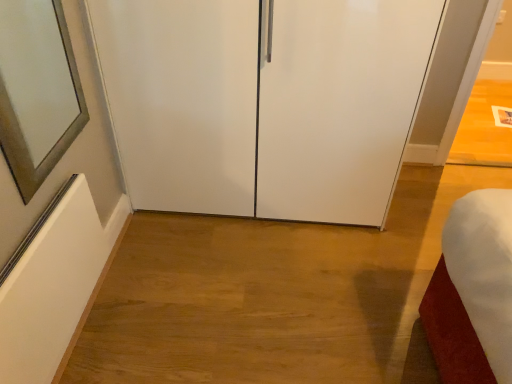
Question: Should I look upward or downward to see satin silver mirror at left?

Choices:
 (A) down
 (B) up

Answer: (B)

Question: Are transparent glass cabinet at center and satin silver mirror at left making contact?

Choices:
 (A) yes
 (B) no

Answer: (B)

Question: Is transparent glass cabinet at center to the right of satin silver mirror at left from the viewer's perspective?

Choices:
 (A) no
 (B) yes

Answer: (B)

Question: Can you confirm if transparent glass cabinet at center is bigger than satin silver mirror at left?

Choices:
 (A) no
 (B) yes

Answer: (B)

Question: Can you confirm if transparent glass cabinet at center is smaller than satin silver mirror at left?

Choices:
 (A) no
 (B) yes

Answer: (A)

Question: Considering the relative sizes of transparent glass cabinet at center and satin silver mirror at left in the image provided, is transparent glass cabinet at center thinner than satin silver mirror at left?

Choices:
 (A) no
 (B) yes

Answer: (A)

Question: Could you tell me if transparent glass cabinet at center is turned towards satin silver mirror at left?

Choices:
 (A) no
 (B) yes

Answer: (B)

Question: Does satin silver mirror at left lie behind transparent glass cabinet at center?

Choices:
 (A) no
 (B) yes

Answer: (A)

Question: Could you tell me if satin silver mirror at left is turned towards transparent glass cabinet at center?

Choices:
 (A) no
 (B) yes

Answer: (A)

Question: From the image's perspective, would you say satin silver mirror at left is shown under transparent glass cabinet at center?

Choices:
 (A) yes
 (B) no

Answer: (A)

Question: From the image's perspective, is satin silver mirror at left on top of transparent glass cabinet at center?

Choices:
 (A) yes
 (B) no

Answer: (B)

Question: Is satin silver mirror at left at the left side of transparent glass cabinet at center?

Choices:
 (A) yes
 (B) no

Answer: (A)

Question: From a real-world perspective, is satin silver mirror at left physically below transparent glass cabinet at center?

Choices:
 (A) no
 (B) yes

Answer: (A)

Question: Considering the positions of transparent glass cabinet at center and satin silver mirror at left in the image, is transparent glass cabinet at center taller or shorter than satin silver mirror at left?

Choices:
 (A) tall
 (B) short

Answer: (A)